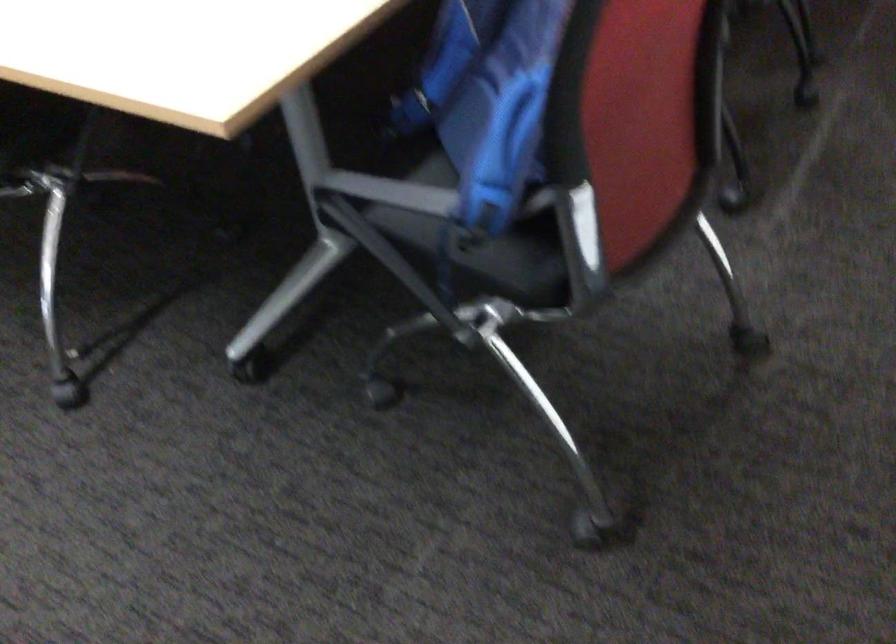
Where is `chair sitting surface`? chair sitting surface is located at coordinates (416, 207).